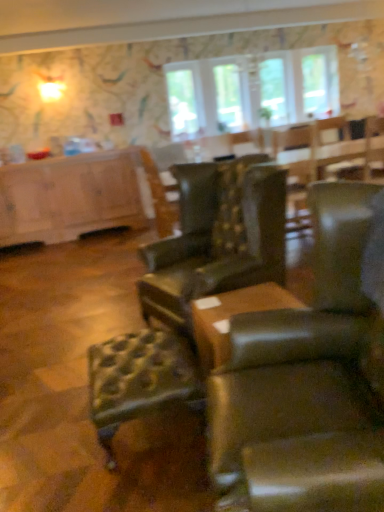
Describe the element at coordinates (273, 89) in the screenshot. I see `clear glass window at upper center, which is the 1th window screen from right to left` at that location.

This screenshot has width=384, height=512. Describe the element at coordinates (230, 318) in the screenshot. I see `brown leather ottoman at center` at that location.

Locate an element on the screen. This screenshot has height=512, width=384. clear glass window at upper center, arranged as the 2th window screen when viewed from the right is located at coordinates (185, 100).

Image resolution: width=384 pixels, height=512 pixels. In order to click on clear glass window at upper center, which is the 1th window screen from right to left in this screenshot , I will do `click(273, 89)`.

Would you say leather armchair at center, arranged as the first chair when viewed from the back, is part of brown leather ottoman at center's contents?

No, brown leather ottoman at center does not contain leather armchair at center, arranged as the first chair when viewed from the back.

Is brown leather ottoman at center aimed at leather armchair at center, the second chair in the front-to-back sequence?

No, brown leather ottoman at center does not turn towards leather armchair at center, the second chair in the front-to-back sequence.

Based on the photo, from the image's perspective, between leather tufted bar stool at center and clear glass window at upper center, which ranks as the 2th window in left-to-right order, who is located below?

leather tufted bar stool at center.

Choose the correct answer: Is leather tufted bar stool at center inside clear glass window at upper center, which appears as the first window when viewed from the right, or outside it?

leather tufted bar stool at center is outside clear glass window at upper center, which appears as the first window when viewed from the right.

Considering the relative positions of leather tufted bar stool at center and clear glass window at upper center, which ranks as the 2th window in left-to-right order, in the image provided, is leather tufted bar stool at center to the right of clear glass window at upper center, which ranks as the 2th window in left-to-right order, from the viewer's perspective?

No.

Which object is further away from the camera, leather tufted bar stool at center or clear glass window at upper center, which ranks as the 2th window in left-to-right order?

clear glass window at upper center, which ranks as the 2th window in left-to-right order, is further from the camera.

Can you confirm if leather tufted bar stool at center is smaller than brown leather ottoman at center?

No.

Considering the sizes of leather tufted bar stool at center and brown leather ottoman at center in the image, is leather tufted bar stool at center wider or thinner than brown leather ottoman at center?

Considering their sizes, leather tufted bar stool at center looks broader than brown leather ottoman at center.

From the image's perspective, is leather tufted bar stool at center on top of brown leather ottoman at center?

Incorrect, from the image's perspective, leather tufted bar stool at center is lower than brown leather ottoman at center.

Between point (142, 364) and point (218, 320), which one is positioned behind?

The point (142, 364) is farther.

Is leather tufted bar stool at center spatially inside clear glass window at upper center, which is the 1th window screen from right to left, or outside of it?

leather tufted bar stool at center exists outside the volume of clear glass window at upper center, which is the 1th window screen from right to left.

Considering the relative sizes of leather tufted bar stool at center and clear glass window at upper center, which is the 1th window screen from right to left, in the image provided, is leather tufted bar stool at center taller than clear glass window at upper center, which is the 1th window screen from right to left,?

No.

Can you confirm if leather tufted bar stool at center is thinner than clear glass window at upper center, the second window screen viewed from the left?

No.

Does clear glass window at upper center, arranged as the 2th window screen when viewed from the right, contain clear glass window at upper center, arranged as the 2th window when viewed from the right?

Actually, clear glass window at upper center, arranged as the 2th window when viewed from the right, is outside clear glass window at upper center, arranged as the 2th window screen when viewed from the right.

Is clear glass window at upper center, arranged as the 2th window screen when viewed from the right, oriented towards clear glass window at upper center, arranged as the 2th window when viewed from the right?

No, clear glass window at upper center, arranged as the 2th window screen when viewed from the right, is not aimed at clear glass window at upper center, arranged as the 2th window when viewed from the right.

From the picture: Are clear glass window at upper center, which appears as the first window screen when viewed from the left, and clear glass window at upper center, arranged as the 2th window when viewed from the right, located far from each other?

That's not correct — clear glass window at upper center, which appears as the first window screen when viewed from the left, is a little close to clear glass window at upper center, arranged as the 2th window when viewed from the right.

Identify the location of window screen to the left of clear glass window at upper center, arranged as the 2th window when viewed from the right. (185, 100).

Based on the photo, is clear glass window at upper center, arranged as the 2th window screen when viewed from the right, aimed at clear glass window at upper center, which is the 1th window screen from right to left?

No, clear glass window at upper center, arranged as the 2th window screen when viewed from the right, is not oriented towards clear glass window at upper center, which is the 1th window screen from right to left.

From a real-world perspective, is clear glass window at upper center, which appears as the first window screen when viewed from the left, below clear glass window at upper center, which is the 1th window screen from right to left?

→ Incorrect, from a real-world perspective, clear glass window at upper center, which appears as the first window screen when viewed from the left, is higher than clear glass window at upper center, which is the 1th window screen from right to left.

Is clear glass window at upper center, which appears as the first window screen when viewed from the left, directly adjacent to clear glass window at upper center, which is the 1th window screen from right to left?

clear glass window at upper center, which appears as the first window screen when viewed from the left, is not next to clear glass window at upper center, which is the 1th window screen from right to left, and they're not touching.

In terms of width, does clear glass window at upper center, which appears as the first window screen when viewed from the left, look wider or thinner when compared to clear glass window at upper center, the second window screen viewed from the left?

Considering their sizes, clear glass window at upper center, which appears as the first window screen when viewed from the left, looks slimmer than clear glass window at upper center, the second window screen viewed from the left.

Considering the positions of points (262, 89) and (60, 241), is point (262, 89) closer to camera compared to point (60, 241)?

No, (262, 89) is further to viewer.

In the image, is clear glass window at upper center, the second window screen viewed from the left, positioned in front of or behind white wood cabinet at left?

clear glass window at upper center, the second window screen viewed from the left, is behind white wood cabinet at left.

From the picture: How much distance is there between clear glass window at upper center, the second window screen viewed from the left, and white wood cabinet at left?

A distance of 2.49 meters exists between clear glass window at upper center, the second window screen viewed from the left, and white wood cabinet at left.

Can you confirm if clear glass window at upper center, the second window screen viewed from the left, is shorter than white wood cabinet at left?

Yes, clear glass window at upper center, the second window screen viewed from the left, is shorter than white wood cabinet at left.

In the image, there is a leather armchair at center, the second chair in the front-to-back sequence. Where is `table below it (from a real-world perspective)`? table below it (from a real-world perspective) is located at coordinates (230, 318).

You are a GUI agent. You are given a task and a screenshot of the screen. Output one action in this format:
    pyautogui.click(x=<x>, y=<y>)
    Task: Click on the 2nd window positioned above the leather tufted bar stool at center (from a real-world perspective)
    
    Given the screenshot: What is the action you would take?
    pyautogui.click(x=316, y=83)

In the scene shown: Which object lies further to the anchor point clear glass window at upper center, which appears as the first window when viewed from the right, leather armchair at center, arranged as the first chair when viewed from the back, or clear glass window at upper center, arranged as the 2th window screen when viewed from the right?

leather armchair at center, arranged as the first chair when viewed from the back.

When comparing their distances from leather tufted bar stool at center, does clear glass window at upper center, the second window screen viewed from the left, or clear glass window at upper center, arranged as the 2th window screen when viewed from the right, seem closer?

clear glass window at upper center, arranged as the 2th window screen when viewed from the right, is closer to leather tufted bar stool at center.

Considering their positions, is leather tufted bar stool at center positioned further to brown leather ottoman at center than clear glass window at upper center, the 1th window in the left-to-right sequence?

Among the two, clear glass window at upper center, the 1th window in the left-to-right sequence, is located further to brown leather ottoman at center.

Estimate the real-world distances between objects in this image. Which object is closer to white wood cabinet at left, leather armchair at center, arranged as the first chair when viewed from the back, or clear glass window at upper center, the 1th window in the left-to-right sequence?

The object closer to white wood cabinet at left is clear glass window at upper center, the 1th window in the left-to-right sequence.

Estimate the real-world distances between objects in this image. Which object is closer to leather at center, the second chair from the back, clear glass window at upper center, arranged as the 2th window screen when viewed from the right, or white wood cabinet at left?

Based on the image, white wood cabinet at left appears to be nearer to leather at center, the second chair from the back.

From the image, which object appears to be nearer to clear glass window at upper center, arranged as the 2th window when viewed from the right, brown leather ottoman at center or leather tufted bar stool at center?

brown leather ottoman at center.

When comparing their distances from leather tufted bar stool at center, does clear glass window at upper center, the 1th window in the left-to-right sequence, or clear glass window at upper center, the second window screen viewed from the left, seem further?

clear glass window at upper center, the second window screen viewed from the left, lies further to leather tufted bar stool at center than the other object.

From the image, which object appears to be nearer to clear glass window at upper center, which appears as the first window screen when viewed from the left, clear glass window at upper center, arranged as the 2th window when viewed from the right, or clear glass window at upper center, the second window screen viewed from the left?

clear glass window at upper center, arranged as the 2th window when viewed from the right.

Where is `window screen between leather at center, the second chair from the back, and clear glass window at upper center, the 1th window in the left-to-right sequence, from front to back`? This screenshot has height=512, width=384. window screen between leather at center, the second chair from the back, and clear glass window at upper center, the 1th window in the left-to-right sequence, from front to back is located at coordinates (185, 100).

Find the location of a particular element. table between leather at center, the second chair from the back, and white wood cabinet at left, along the z-axis is located at coordinates (230, 318).

Identify the location of bar stool between leather at center, the second chair from the back, and leather armchair at center, arranged as the first chair when viewed from the back, in the front-back direction. The width and height of the screenshot is (384, 512). (138, 380).

The height and width of the screenshot is (512, 384). I want to click on window between white wood cabinet at left and clear glass window at upper center, which appears as the first window when viewed from the right, so click(228, 98).